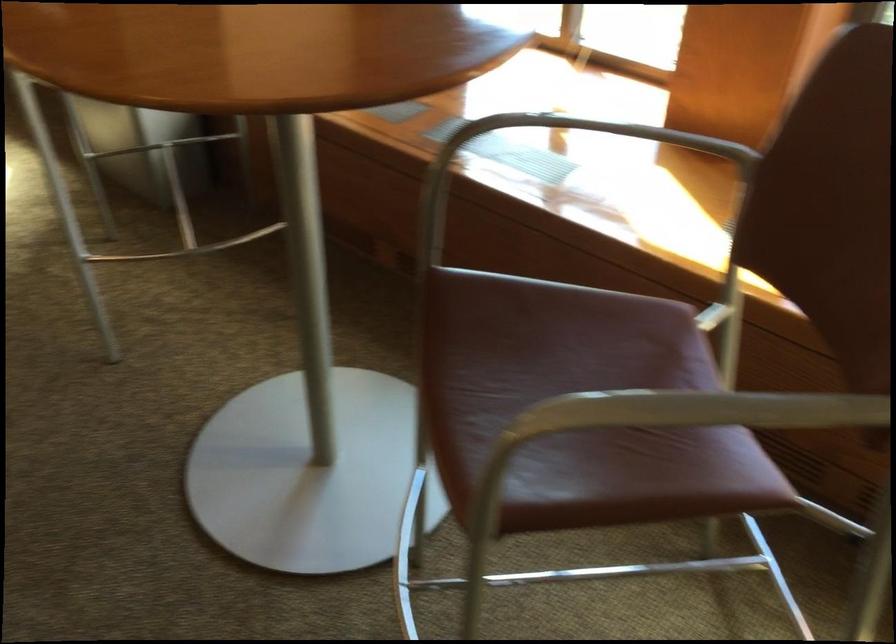
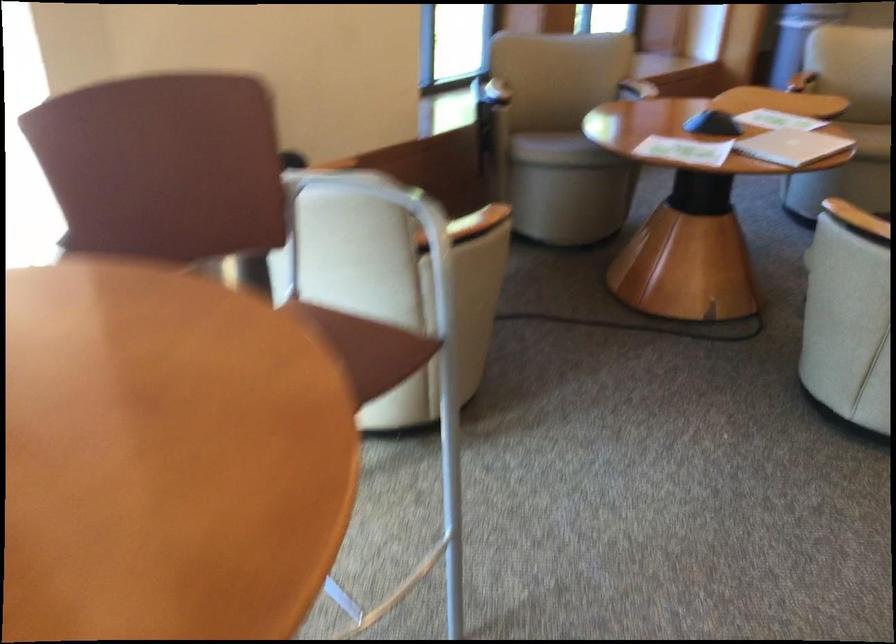
Question: I am providing you with two images of the same scene from different viewpoints. After the viewpoint changes to image2, which objects are now occluded?

Choices:
 (A) wooden utensil
 (B) closed silver laptop
 (C) chair armrest
 (D) beige chair sitting surface

Answer: (C)